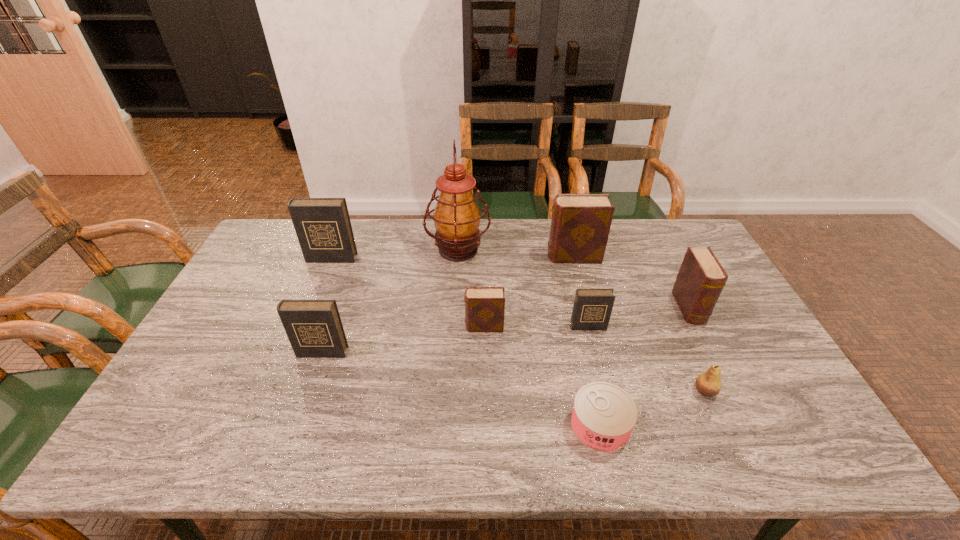
Where is `vacant space at the far edge`? vacant space at the far edge is located at coordinates (532, 228).

In the image, there is a desktop. Where is `vacant space at the near edge`? The width and height of the screenshot is (960, 540). vacant space at the near edge is located at coordinates (252, 431).

Image resolution: width=960 pixels, height=540 pixels. What are the coordinates of `free point at the left edge` in the screenshot? It's located at (226, 324).

In the image, there is a desktop. Where is `vacant space at the right edge`? vacant space at the right edge is located at coordinates (727, 351).

Image resolution: width=960 pixels, height=540 pixels. I want to click on free space at the far left corner of the desktop, so click(x=290, y=232).

Identify the location of empty location between the leftmost brown diary and the eighth object from left to right. (594, 359).

Locate an element on the screen. Image resolution: width=960 pixels, height=540 pixels. empty space between the can and the second brown diary from right to left is located at coordinates (587, 341).

This screenshot has width=960, height=540. Find the location of `unoccupied area between the shortest object and the rightmost diary`. unoccupied area between the shortest object and the rightmost diary is located at coordinates (644, 367).

I want to click on vacant region between the shortest object and the nearest dark diary, so click(461, 389).

Locate an element on the screen. free space that is in between the farthest dark diary and the oil lamp is located at coordinates (395, 254).